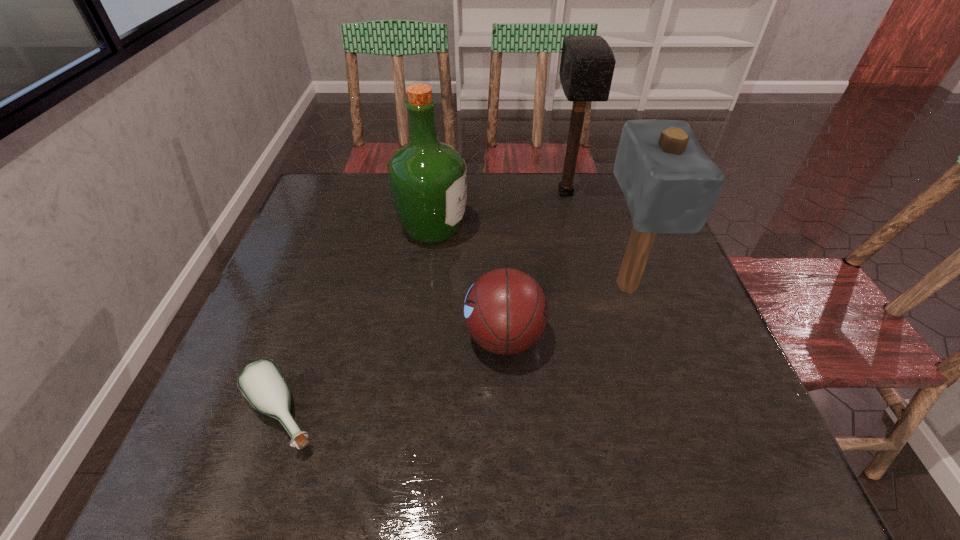
Image resolution: width=960 pixels, height=540 pixels. In order to click on vacant space located 0.050m on the left of the bottle in this screenshot , I will do `click(210, 413)`.

Locate an element on the screen. mallet that is positioned at the far edge is located at coordinates (587, 64).

At what (x,y) coordinates should I click in order to perform the action: click on liquor that is positioned at the far edge. Please return your answer as a coordinate pair (x, y). Looking at the image, I should click on (428, 179).

Where is `object positioned at the near edge`? The image size is (960, 540). object positioned at the near edge is located at coordinates (262, 384).

Locate an element on the screen. object present at the left edge is located at coordinates (262, 384).

You are a GUI agent. You are given a task and a screenshot of the screen. Output one action in this format:
    pyautogui.click(x=<x>, y=<y>)
    Task: Click on the object situated at the right edge
    
    Given the screenshot: What is the action you would take?
    pyautogui.click(x=670, y=185)

You are a GUI agent. You are given a task and a screenshot of the screen. Output one action in this format:
    pyautogui.click(x=<x>, y=<y>)
    Task: Click on the object that is at the near left corner
    The image size is (960, 540).
    Given the screenshot: What is the action you would take?
    pyautogui.click(x=262, y=384)

Where is `vacant area at the far edge of the desktop`? The image size is (960, 540). vacant area at the far edge of the desktop is located at coordinates (505, 184).

Find the location of `vacant area at the near edge`. vacant area at the near edge is located at coordinates (603, 465).

Locate an element on the screen. The height and width of the screenshot is (540, 960). vacant space at the left edge is located at coordinates tap(337, 247).